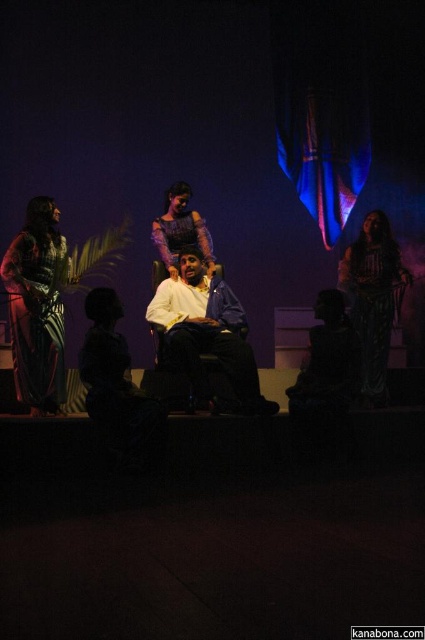
You are an actor standing at the center of the stage. You need to move to the plaid fabric dress at left. Which direction should you move to reach it?

The plaid fabric dress at left is located at point (x=37, y=307), so you should move to the left direction to reach it.

You are a costume designer observing the stage setup. You need to determine which dress is shorter between the plaid fabric dress at left and the silky green dress at right. Based on the scene description, which one is shorter?

The plaid fabric dress at left is shorter than the silky green dress at right.

You are a costume designer preparing for a play. You have two dresses available for the lead actress. The plaid fabric dress at left and the silky green dress at right. The director wants the dress to have a fuller silhouette. Which dress should you choose?

The silky green dress at right has a fuller silhouette because it is thicker than the plaid fabric dress at left, so you should choose the silky green dress at right.